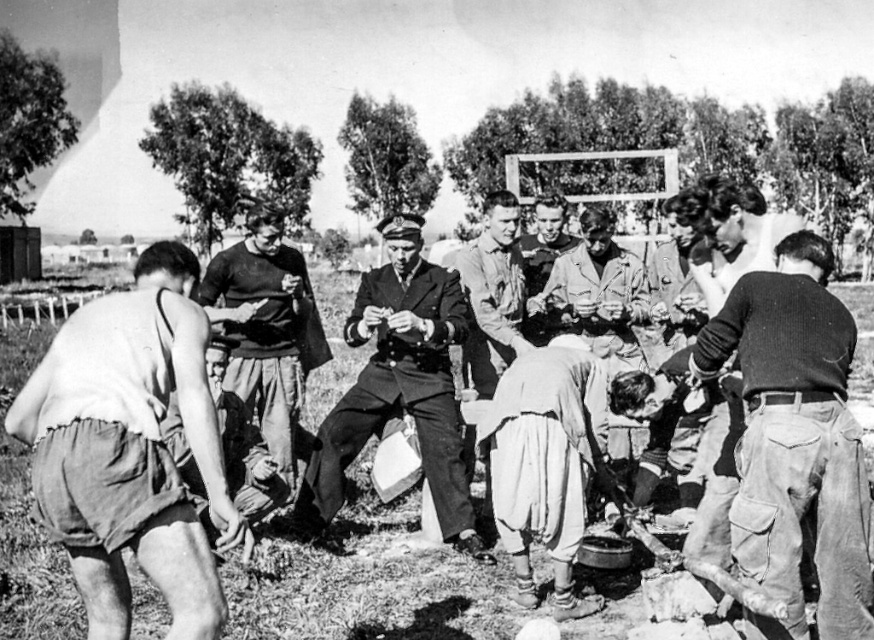
Is uniformed man at center wider than dark gray sweater at center?

Correct, the width of uniformed man at center exceeds that of dark gray sweater at center.

In order to click on uniformed man at center in this screenshot , I will do `click(400, 385)`.

In the scene shown: Between dirty shorts at left and dark gray sweater at center, which one has more height?

dark gray sweater at center is taller.

Can you confirm if dirty shorts at left is wider than dark gray sweater at center?

No, dirty shorts at left is not wider than dark gray sweater at center.

Is point (205, 540) farther from camera compared to point (236, 392)?

That is False.

At what (x,y) coordinates should I click in order to perform the action: click on dirty shorts at left. Please return your answer as a coordinate pair (x, y). This screenshot has height=640, width=874. Looking at the image, I should click on (130, 449).

Who is more forward, (108, 547) or (428, 316)?

Point (108, 547) is in front.

Which is behind, point (82, 417) or point (351, 340)?

Point (351, 340)

This screenshot has width=874, height=640. What do you see at coordinates (130, 449) in the screenshot? I see `dirty shorts at left` at bounding box center [130, 449].

Locate an element on the screen. Image resolution: width=874 pixels, height=640 pixels. dirty shorts at left is located at coordinates (130, 449).